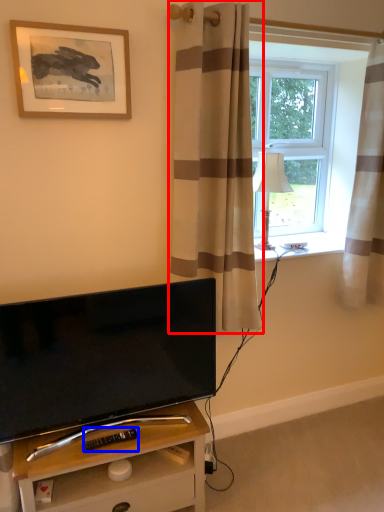
Question: Which object appears closest to the camera in this image, curtain (highlighted by a red box) or remote control (highlighted by a blue box)?

Choices:
 (A) curtain
 (B) remote control

Answer: (A)